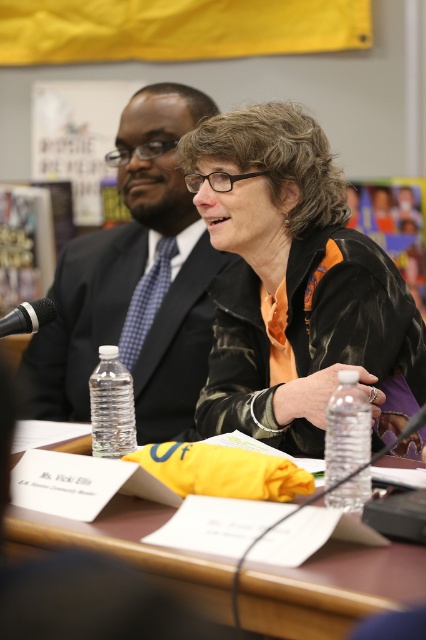
You are a photographer standing at the point marked as point (149, 308). You want to take a photo of both individuals at the same time. Given that your camera has a 50mm lens, which has a field of view of 46 degrees, will you be able to capture both people in the frame?

The two individuals are 2.26 meters apart. With a 50mm lens providing a 46 degree field of view, the maximum distance between subjects that can be captured in the frame would depend on the camera sensor size and distance from the subject. However, without knowing the exact distance from the camera to the subjects, it is impossible to definitively determine if both can be captured. The question lacks sufficient information to provide a precise answer.

You are organizing a conference and need to ensure that the blue checkered tie at center and the black metallic microphone at left can fit side by side on a shelf. What should you consider about their widths?

You should consider whether the combined width of the blue checkered tie at center and the black metallic microphone at left will exceed the shelf space available, as the blue checkered tie at center might be wider than the microphone.

You are a photographer standing at a certain position. You want to take a photo of the brown wooden table at center so that it fills the frame without any distortion. The camera you are using has a minimum focusing distance of 34 inches. Can you take the photo from your current position?

The brown wooden table at center and camera are 33.86 inches apart from each other. Since the minimum focusing distance is 34 inches, the camera is too close to the table to take a clear photo without distortion. You need to move back to ensure the distance is at least 34 inches.